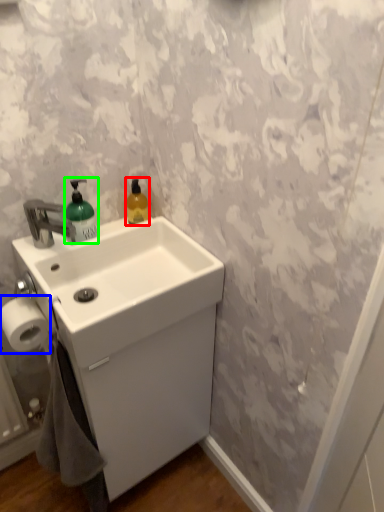
Question: Which object is the closest to the cleaning product (highlighted by a red box)? Choose among these: toilet paper (highlighted by a blue box) or soap dispenser (highlighted by a green box).

Choices:
 (A) toilet paper
 (B) soap dispenser

Answer: (B)